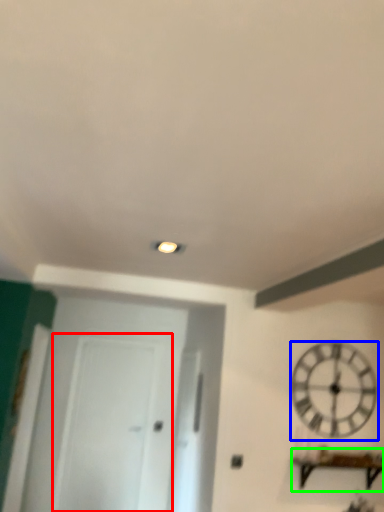
Question: Which object is positioned farthest from glass door (highlighted by a red box)? Select from wall clock (highlighted by a blue box) and furniture (highlighted by a green box).

Choices:
 (A) wall clock
 (B) furniture

Answer: (B)